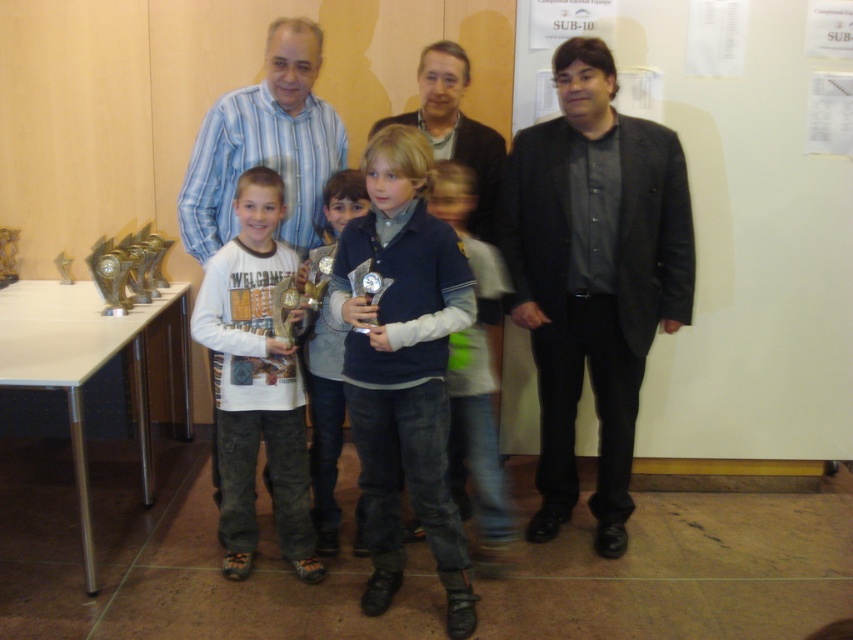
You are a photographer trying to capture a group photo where the dark gray textured blazer at right and the dark blue denim jeans at center are both visible. Considering their sizes, which one might require more space in the frame to avoid being cropped?

The dark gray textured blazer at right is wider than the dark blue denim jeans at center, so it might require more space in the frame to avoid being cropped.